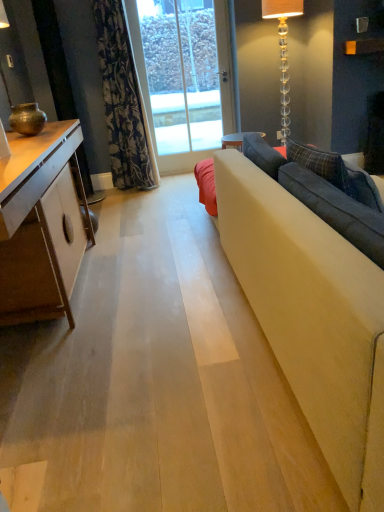
Question: Considering the positions of clear glass door at center and clear glass floor lamp at upper right, the first lamp viewed from the right, in the image, is clear glass door at center wider or thinner than clear glass floor lamp at upper right, the first lamp viewed from the right,?

Choices:
 (A) wide
 (B) thin

Answer: (B)

Question: Is point (155, 143) closer or farther from the camera than point (281, 38)?

Choices:
 (A) closer
 (B) farther

Answer: (B)

Question: Which object is positioned farthest from the clear glass door at center?

Choices:
 (A) floral fabric curtain at upper left
 (B) white glossy cabinet at left
 (C) matte bronze lamp at left, which ranks as the 1th lamp in left-to-right order
 (D) clear glass floor lamp at upper right, the 2th lamp when ordered from left to right

Answer: (B)

Question: Estimate the real-world distances between objects in this image. Which object is closer to the clear glass door at center?

Choices:
 (A) floral fabric curtain at upper left
 (B) clear glass floor lamp at upper right, placed as the 1th lamp when sorted from back to front
 (C) matte bronze lamp at left, which appears as the 2th lamp when viewed from the right
 (D) white glossy cabinet at left

Answer: (B)